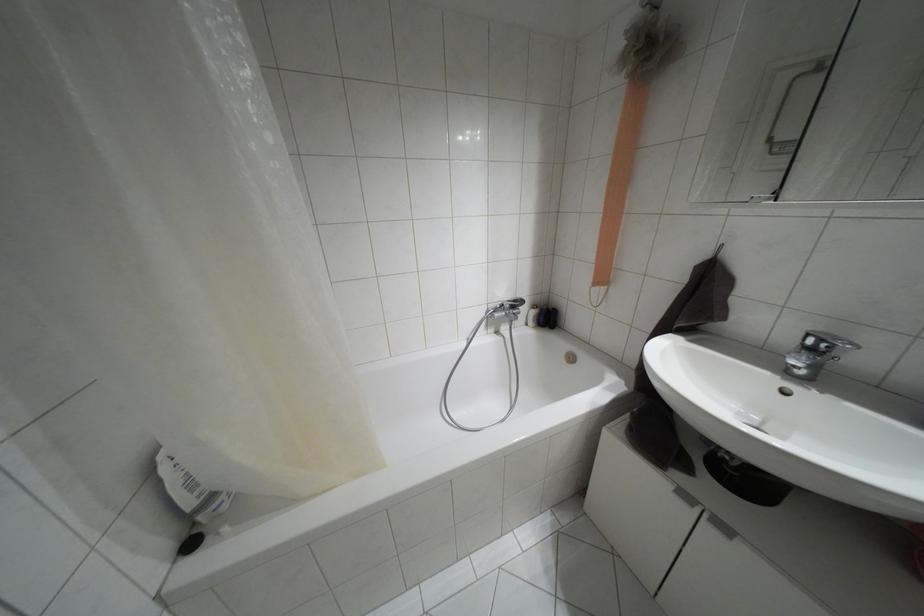
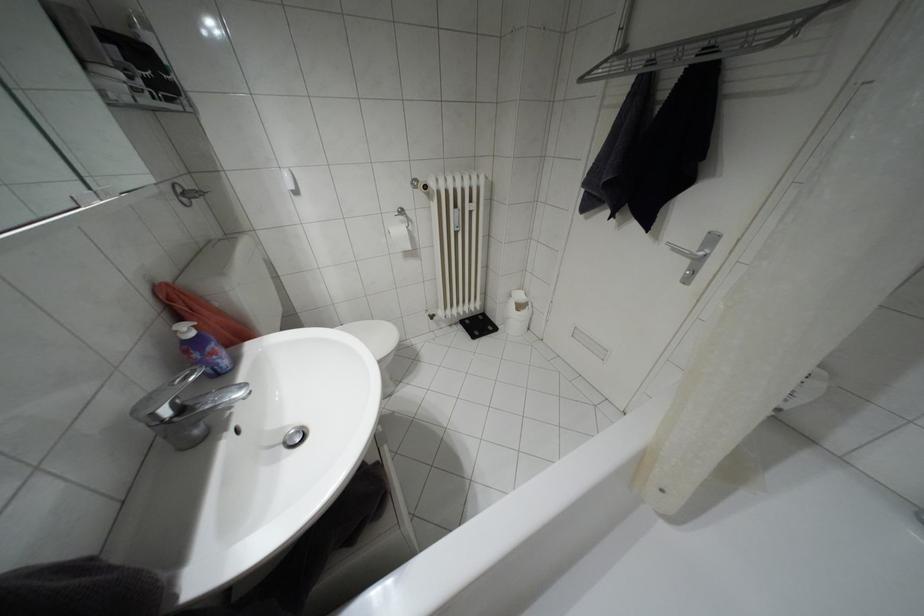
In the second image, find the point that corresponds to (x=811, y=350) in the first image.

(180, 408)